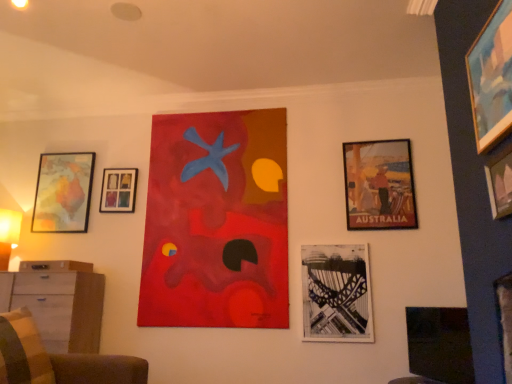
Question: From the image's perspective, is matte paper poster at right, the fifth picture frame when ordered from front to back, located beneath matte wooden map at left, which is counted as the 1th picture frame, starting from the left?

Choices:
 (A) no
 (B) yes

Answer: (A)

Question: Is matte paper poster at right, the 2th picture frame positioned from the right, positioned far away from matte wooden map at left, the 1th picture frame positioned from the back?

Choices:
 (A) yes
 (B) no

Answer: (A)

Question: Does matte paper poster at right, which appears as the third picture frame when viewed from the back, have a lesser width compared to matte wooden map at left, which is the seventh picture frame in right-to-left order?

Choices:
 (A) yes
 (B) no

Answer: (B)

Question: Is the position of matte paper poster at right, the fifth picture frame when ordered from front to back, more distant than that of matte wooden map at left, which ranks as the seventh picture frame in front-to-back order?

Choices:
 (A) yes
 (B) no

Answer: (B)

Question: Does matte paper poster at right, the 2th picture frame positioned from the right, have a greater height compared to matte wooden map at left, which ranks as the seventh picture frame in front-to-back order?

Choices:
 (A) yes
 (B) no

Answer: (A)

Question: In terms of width, does plaid fabric pillow at lower left look wider or thinner when compared to matte paper poster at right, which appears as the third picture frame when viewed from the back?

Choices:
 (A) thin
 (B) wide

Answer: (B)

Question: From the image's perspective, is plaid fabric pillow at lower left above or below matte paper poster at right, the fifth picture frame when ordered from front to back?

Choices:
 (A) below
 (B) above

Answer: (A)

Question: Would you say plaid fabric pillow at lower left is to the left or to the right of matte paper poster at right, the 6th picture frame in the left-to-right sequence, in the picture?

Choices:
 (A) right
 (B) left

Answer: (B)

Question: From a real-world perspective, is plaid fabric pillow at lower left positioned above or below matte paper poster at right, the 2th picture frame positioned from the right?

Choices:
 (A) above
 (B) below

Answer: (B)

Question: From the image's perspective, is matte paper poster at right, the fifth picture frame when ordered from front to back, above or below yellow fabric lampshade at left?

Choices:
 (A) below
 (B) above

Answer: (B)

Question: Considering the positions of matte paper poster at right, the fifth picture frame when ordered from front to back, and yellow fabric lampshade at left in the image, is matte paper poster at right, the fifth picture frame when ordered from front to back, wider or thinner than yellow fabric lampshade at left?

Choices:
 (A) thin
 (B) wide

Answer: (A)

Question: From a real-world perspective, is matte paper poster at right, the 2th picture frame positioned from the right, physically located above or below yellow fabric lampshade at left?

Choices:
 (A) below
 (B) above

Answer: (B)

Question: Is matte paper poster at right, the fifth picture frame when ordered from front to back, spatially inside yellow fabric lampshade at left, or outside of it?

Choices:
 (A) outside
 (B) inside

Answer: (A)

Question: Based on their sizes in the image, would you say velvet brown armchair at lower left is bigger or smaller than black paper bridge at lower center, placed as the 3th picture frame when sorted from front to back?

Choices:
 (A) big
 (B) small

Answer: (A)

Question: Visually, is velvet brown armchair at lower left positioned to the left or to the right of black paper bridge at lower center, placed as the 3th picture frame when sorted from front to back?

Choices:
 (A) right
 (B) left

Answer: (B)